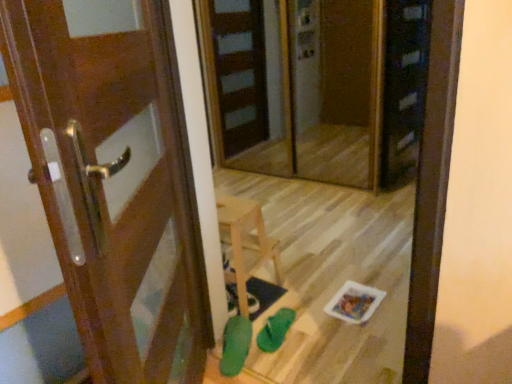
Where is `vacant area in front of green rubber shoe at lower center, which is the 1th shoe from right to left`? vacant area in front of green rubber shoe at lower center, which is the 1th shoe from right to left is located at coordinates (287, 358).